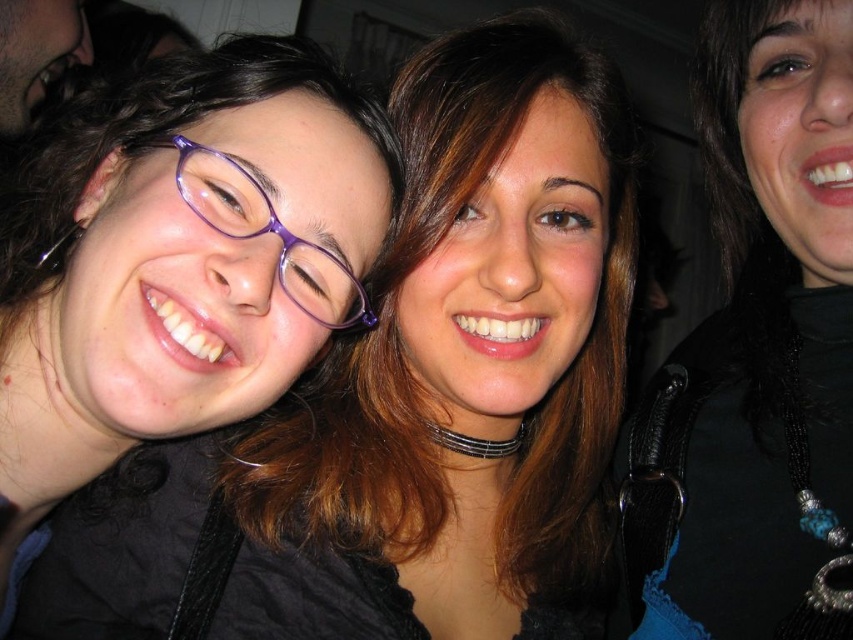
You are a photographer adjusting the camera focus. You need to ensure both the matte black jacket at center and the black beaded necklace at upper right are in focus. Which object should you focus on first to account for their sizes?

The matte black jacket at center is shorter than the black beaded necklace at upper right. Since the jacket is smaller, you should focus on the matte black jacket at center first to ensure it is sharp before adjusting for the larger necklace.

You are a photographer trying to adjust the lighting for a closeup shot of the two women in the image. You need to ensure that the matte black jacket at center and the black beaded necklace at upper right are both well lit. Based on their positions, which object should you focus the light on first to ensure proper illumination?

The matte black jacket at center is positioned on the left side of the black beaded necklace at upper right. Since the jacket is at the center and closer to the viewer, focusing the light on the matte black jacket at center first would ensure it is properly illuminated before adjusting for the necklace.

You are a photographer adjusting your camera settings to capture the details of the matte black jacket at center and the black beaded necklace at upper right. Which object should you focus on first to ensure both are in sharp focus?

You should focus on the matte black jacket at center first because it is closer to you than the black beaded necklace at upper right, so focusing on it will help ensure both are in sharp focus.